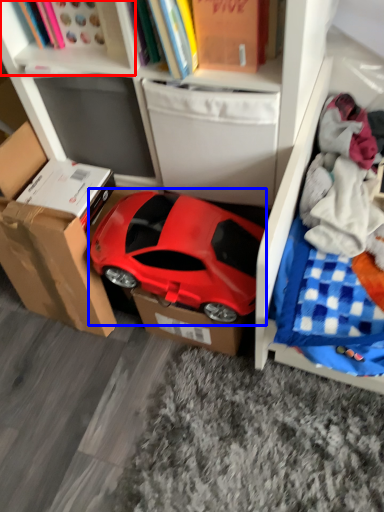
Question: Among these objects, which one is farthest to the camera, cabinet (highlighted by a red box) or car (highlighted by a blue box)?

Choices:
 (A) cabinet
 (B) car

Answer: (B)